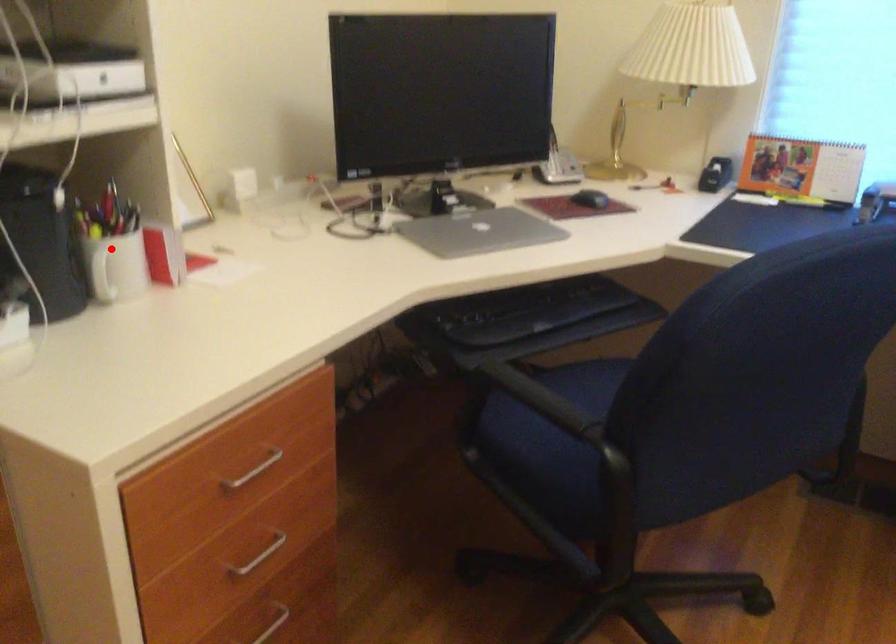
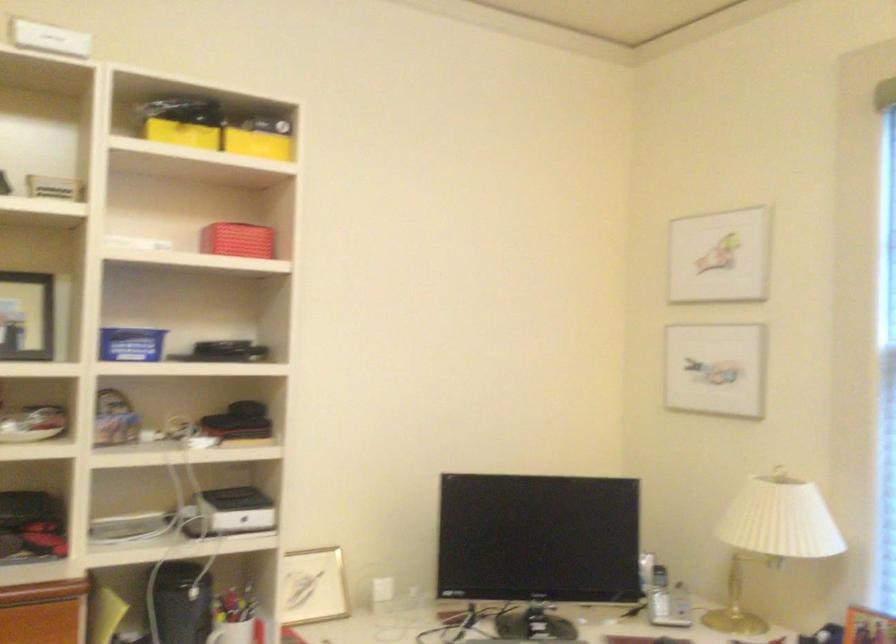
Question: I am providing you with two images of the same scene from different viewpoints. In image1, a red point is highlighted. Considering the same 3D point in image2, which of the following is correct?

Choices:
 (A) It is closer
 (B) It is farther

Answer: (B)